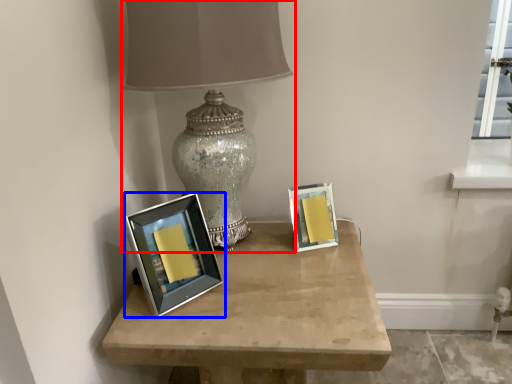
Question: Which of the following is the farthest to the observer, lamp (highlighted by a red box) or picture frame (highlighted by a blue box)?

Choices:
 (A) lamp
 (B) picture frame

Answer: (B)